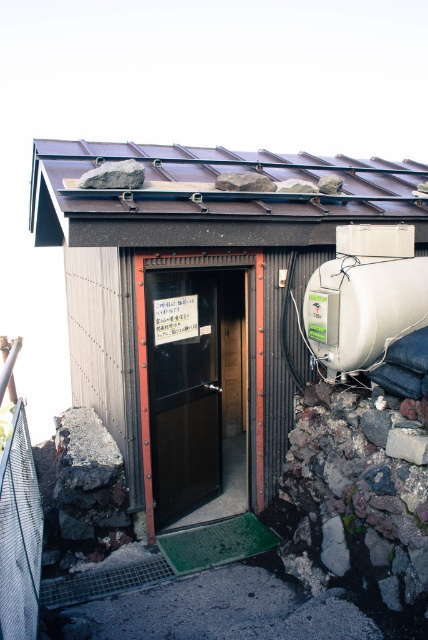
Which is behind, point (124, 244) or point (214, 273)?

Positioned behind is point (214, 273).

This screenshot has height=640, width=428. Describe the element at coordinates (211, 196) in the screenshot. I see `brown corrugated metal roof at upper center` at that location.

What do you see at coordinates (211, 196) in the screenshot? I see `brown corrugated metal roof at upper center` at bounding box center [211, 196].

The height and width of the screenshot is (640, 428). What are the coordinates of `brown corrugated metal roof at upper center` in the screenshot? It's located at (211, 196).

You are a GUI agent. You are given a task and a screenshot of the screen. Output one action in this format:
    pyautogui.click(x=<x>, y=<y>)
    Task: Click on the brown corrugated metal hut at center
    The image size is (428, 640).
    Given the screenshot: What is the action you would take?
    pyautogui.click(x=199, y=298)

Who is lower down, brown corrugated metal hut at center or brown corrugated metal roof at upper center?

brown corrugated metal hut at center is lower down.

Where is `brown corrugated metal hut at center`? The image size is (428, 640). brown corrugated metal hut at center is located at coordinates pos(199,298).

Is point (294, 323) farther from viewer compared to point (219, 452)?

No, (294, 323) is closer to viewer.

Is brown corrugated metal hut at center below matte black door at center?

Actually, brown corrugated metal hut at center is above matte black door at center.

Does point (186, 164) come in front of point (225, 285)?

Yes, point (186, 164) is closer to viewer.

At what (x,y) coordinates should I click in order to perform the action: click on brown corrugated metal hut at center. Please return your answer as a coordinate pair (x, y). The width and height of the screenshot is (428, 640). Looking at the image, I should click on (199, 298).